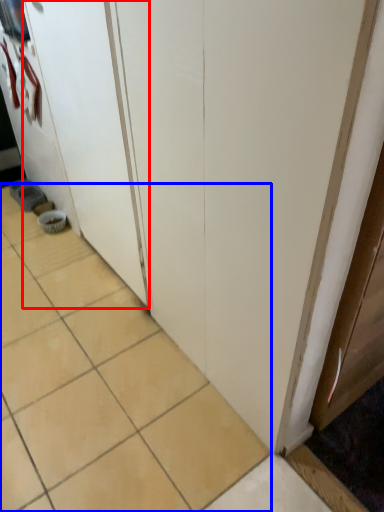
Question: Which object appears closest to the camera in this image, screen door (highlighted by a red box) or ceramic tile (highlighted by a blue box)?

Choices:
 (A) screen door
 (B) ceramic tile

Answer: (B)